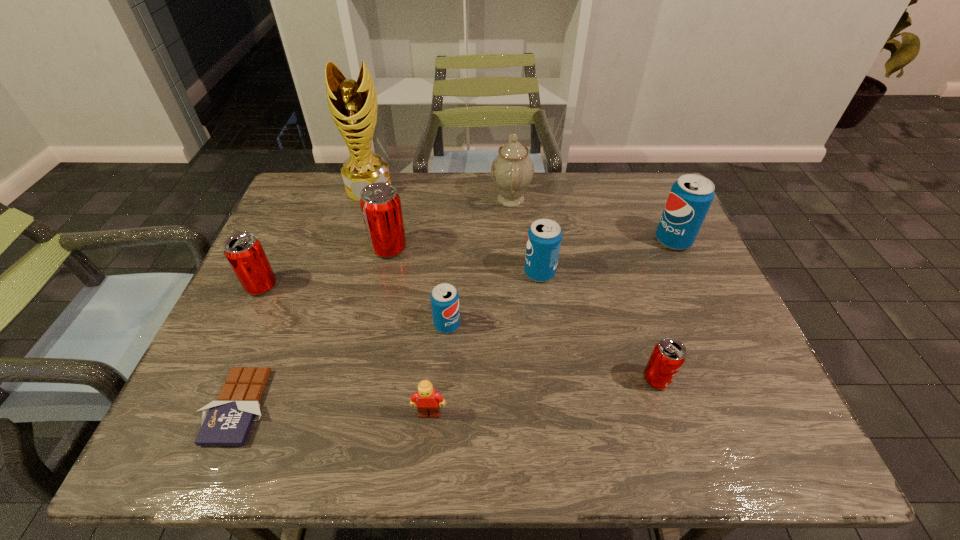
You are a GUI agent. You are given a task and a screenshot of the screen. Output one action in this format:
    pyautogui.click(x=<x>, y=<y>)
    Task: Click on the free space located on the spout of the chinaware
    
    Given the screenshot: What is the action you would take?
    pyautogui.click(x=372, y=199)

Locate an element on the screen. The image size is (960, 540). vacant area located on the front of the rightmost soda can is located at coordinates (726, 355).

Where is `free spot located on the right of the second red soda can from right to left`? This screenshot has height=540, width=960. free spot located on the right of the second red soda can from right to left is located at coordinates (492, 248).

You are a GUI agent. You are given a task and a screenshot of the screen. Output one action in this format:
    pyautogui.click(x=<x>, y=<y>)
    Task: Click on the vacant region located on the front of the second blue soda can from left to right
    
    Given the screenshot: What is the action you would take?
    pyautogui.click(x=551, y=357)

This screenshot has width=960, height=540. I want to click on vacant space located on the front of the second nearest red soda can, so click(201, 416).

Identify the location of vacant space situated 0.070m on the front of the second soda can from right to left. The width and height of the screenshot is (960, 540). (671, 424).

Image resolution: width=960 pixels, height=540 pixels. I want to click on vacant space located 0.160m on the back of the third soda can from left to right, so click(x=451, y=267).

This screenshot has height=540, width=960. Identify the location of free space located on the right of the shortest object. (390, 407).

Locate an element on the screen. award located at the far edge is located at coordinates (353, 105).

Identify the location of chinaware at the far edge. (512, 170).